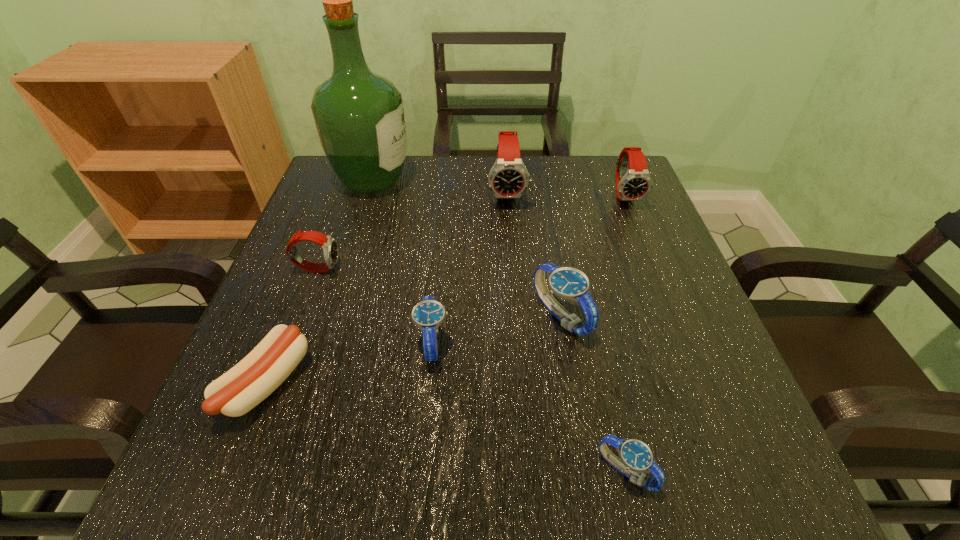
This screenshot has width=960, height=540. Find the location of `green liquor`. green liquor is located at coordinates (359, 116).

Locate an element on the screen. The image size is (960, 540). the tallest object is located at coordinates (359, 116).

I want to click on the second tallest object, so click(508, 178).

Where is `the second red watch from right to left`? The height and width of the screenshot is (540, 960). the second red watch from right to left is located at coordinates (508, 178).

You are a GUI agent. You are given a task and a screenshot of the screen. Output one action in this format:
    pyautogui.click(x=<x>, y=<y>)
    Task: Click on the second biggest red watch
    The image size is (960, 540).
    Given the screenshot: What is the action you would take?
    pyautogui.click(x=633, y=182)

Identify the location of the rightmost object. The height and width of the screenshot is (540, 960). (633, 182).

At what (x,y) coordinates should I click in order to perform the action: click on the biggest blue watch. Please return your answer as a coordinate pair (x, y). Looking at the image, I should click on (567, 283).

The image size is (960, 540). Find the location of `the nearest red watch`. the nearest red watch is located at coordinates (330, 248).

This screenshot has width=960, height=540. What are the coordinates of `the leftmost watch` in the screenshot? It's located at (330, 248).

You are a GUI agent. You are given a task and a screenshot of the screen. Output one action in this format:
    pyautogui.click(x=<x>, y=<y>)
    Task: Click on the fifth watch from right to left
    
    Given the screenshot: What is the action you would take?
    pyautogui.click(x=428, y=314)